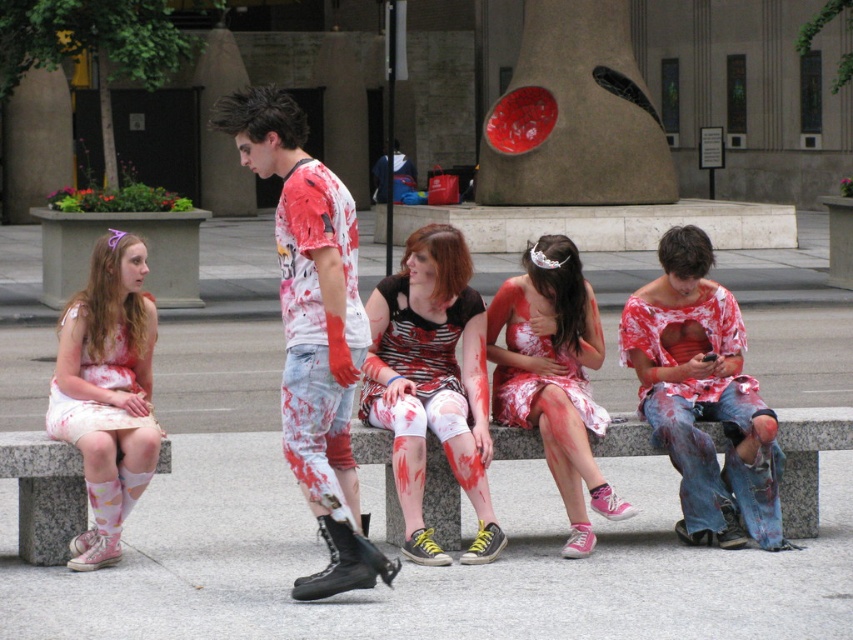
Question: Does striped jersey at center have a smaller size compared to matte pink dress at center?

Choices:
 (A) yes
 (B) no

Answer: (A)

Question: Which of the following is the closest to the observer?

Choices:
 (A) white lace dress at left
 (B) matte pink dress at center
 (C) matte red shirt at center
 (D) striped jersey at center

Answer: (A)

Question: Among these objects, which one is farthest from the camera?

Choices:
 (A) matte red shirt at center
 (B) striped jersey at center
 (C) white floral dress at left
 (D) white lace dress at left

Answer: (A)

Question: Is painted fabric shirt at center to the right of striped jersey at center from the viewer's perspective?

Choices:
 (A) no
 (B) yes

Answer: (A)

Question: Which point appears closest to the camera in this image?

Choices:
 (A) (763, 452)
 (B) (569, 300)
 (C) (465, 356)
 (D) (131, 449)

Answer: (D)

Question: From the image, what is the correct spatial relationship of white floral dress at left in relation to matte pink dress at center?

Choices:
 (A) left
 (B) right

Answer: (A)